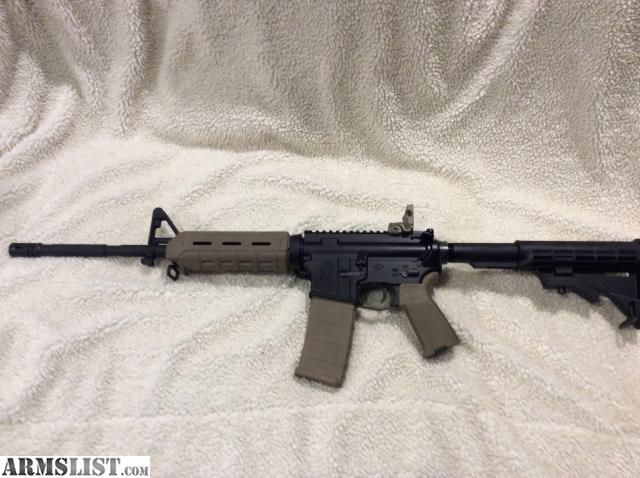
You are a GUI agent. You are given a task and a screenshot of the screen. Output one action in this format:
    pyautogui.click(x=<x>, y=<y>)
    Task: Click on the magazine
    
    Given the screenshot: What is the action you would take?
    pyautogui.click(x=305, y=368)